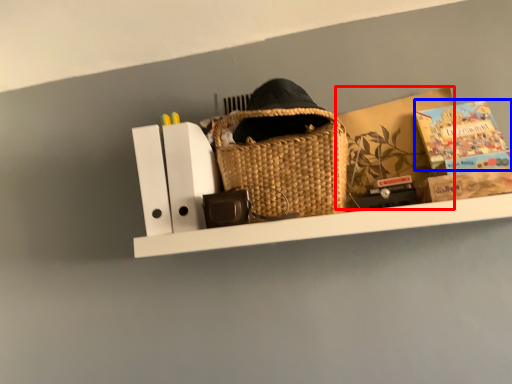
Question: Among these objects, which one is nearest to the camera, cardboard box (highlighted by a red box) or paperback book (highlighted by a blue box)?

Choices:
 (A) cardboard box
 (B) paperback book

Answer: (B)